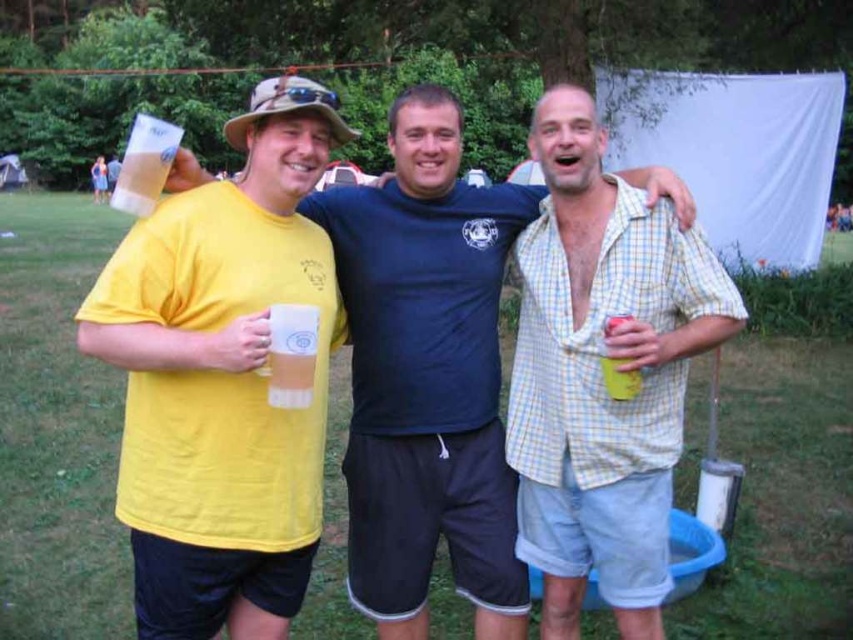
Is point (433, 474) in front of point (616, 208)?

No, (433, 474) is further to viewer.

Does yellow matte t-shirt at center appear over yellow plaid shirt at center?

Yes.

Is point (416, 481) farther from viewer compared to point (521, 474)?

That is False.

Locate an element on the screen. This screenshot has width=853, height=640. yellow matte t-shirt at center is located at coordinates (426, 374).

Who is more distant from viewer, (277, 390) or (631, 392)?

The point (631, 392) is behind.

Who is more forward, (x=297, y=349) or (x=614, y=372)?

Point (x=297, y=349) is in front.

Which is in front, point (312, 356) or point (610, 324)?

Point (312, 356) is more forward.

This screenshot has height=640, width=853. I want to click on translucent plastic cup at center, so click(291, 355).

You are a GUI agent. You are given a task and a screenshot of the screen. Output one action in this format:
    pyautogui.click(x=<x>, y=<y>)
    Task: Click on the matte yellow t-shirt at center
    The width and height of the screenshot is (853, 640).
    Given the screenshot: What is the action you would take?
    pyautogui.click(x=222, y=380)

Is point (320, 305) less distant than point (383, 426)?

Yes.

The height and width of the screenshot is (640, 853). Find the location of `matte yellow t-shirt at center`. matte yellow t-shirt at center is located at coordinates (222, 380).